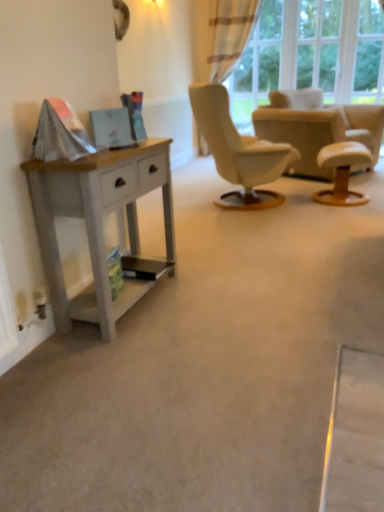
Locate an element on the screen. Image resolution: width=384 pixels, height=512 pixels. free region on the left part of white leather stool at right is located at coordinates (290, 201).